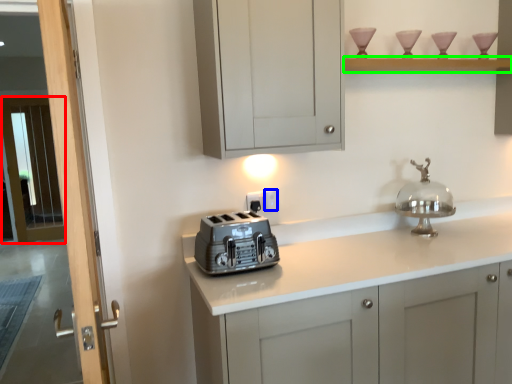
Question: Which object is positioned farthest from screen door (highlighted by a red box)? Select from electric outlet (highlighted by a blue box) and shelf (highlighted by a green box).

Choices:
 (A) electric outlet
 (B) shelf

Answer: (B)